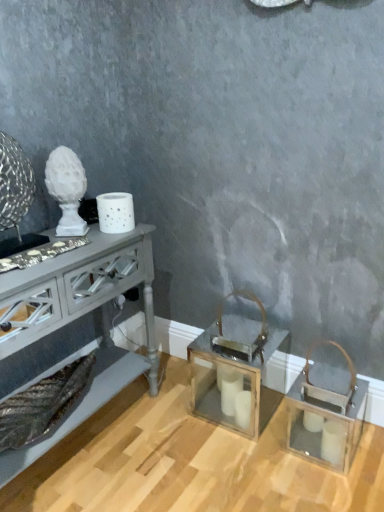
I want to click on free location in front of clear glass lantern at center, the 1th table positioned from the right, so click(231, 462).